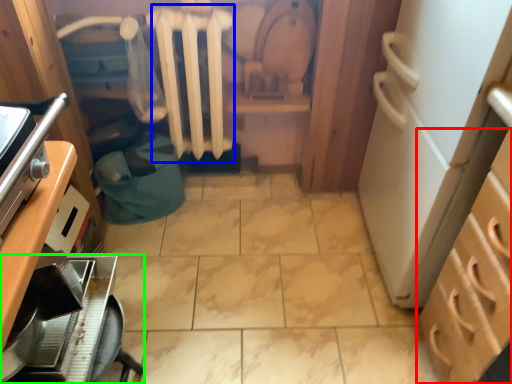
Question: Based on their relative distances, which object is nearer to cabinetry (highlighted by a red box)? Choose from radiator (highlighted by a blue box) and kitchen appliance (highlighted by a green box).

Choices:
 (A) radiator
 (B) kitchen appliance

Answer: (B)